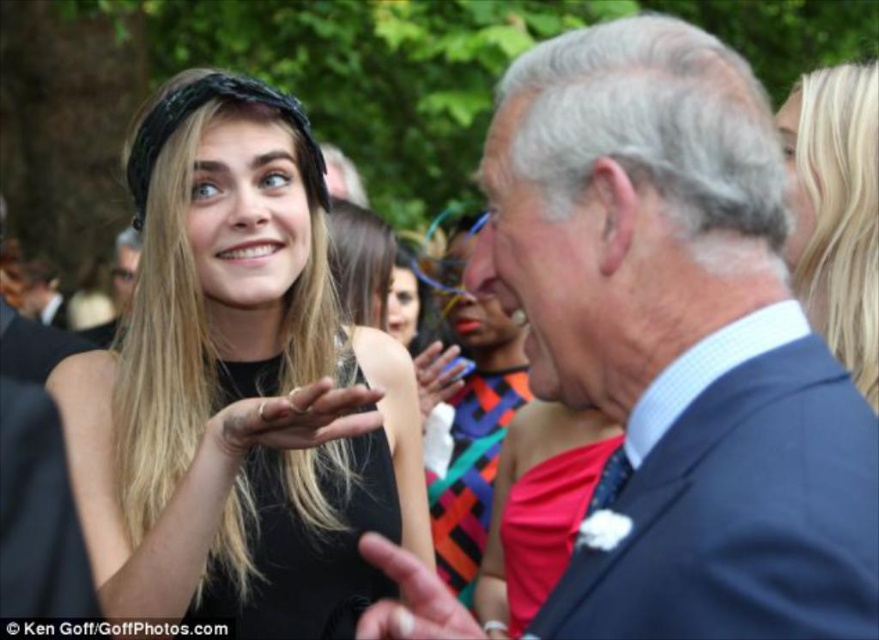
Question: Which point is closer to the camera?

Choices:
 (A) navy blue suit at center
 (B) blonde hair at upper right

Answer: (A)

Question: Considering the real-world distances, which object is farthest from the navy blue suit at center?

Choices:
 (A) blonde hair at upper right
 (B) black satin dress at left
 (C) multicolored fabric dress at center
 (D) matte black suit at center

Answer: (D)

Question: Does black satin dress at left have a lesser width compared to multicolored fabric dress at center?

Choices:
 (A) yes
 (B) no

Answer: (B)

Question: Which of the following is the farthest from the observer?

Choices:
 (A) (121, 260)
 (B) (790, 122)
 (C) (451, 432)
 (D) (236, 300)

Answer: (A)

Question: Is blonde hair at upper right to the left of multicolored fabric dress at center from the viewer's perspective?

Choices:
 (A) yes
 (B) no

Answer: (B)

Question: Can you confirm if navy blue suit at center is positioned to the right of black satin dress at left?

Choices:
 (A) no
 (B) yes

Answer: (B)